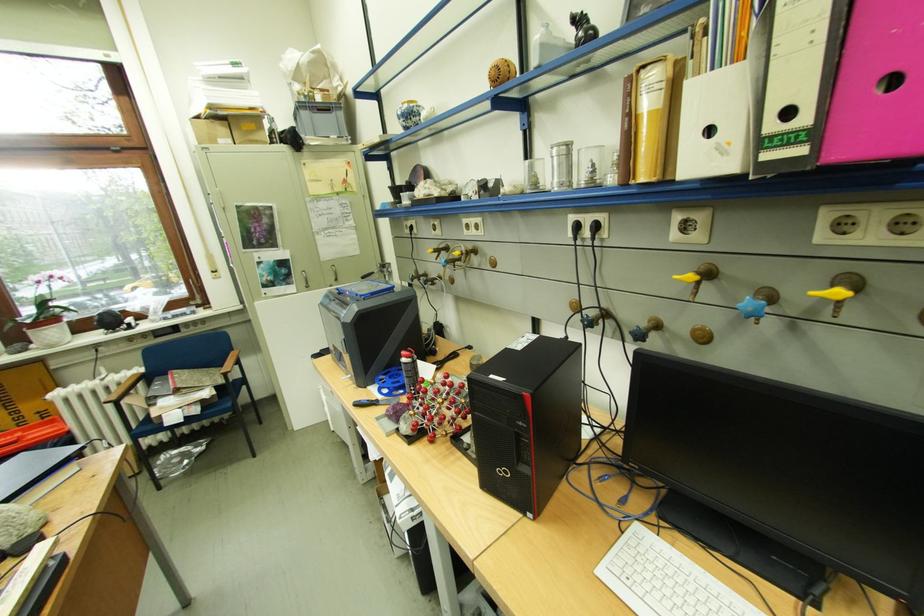
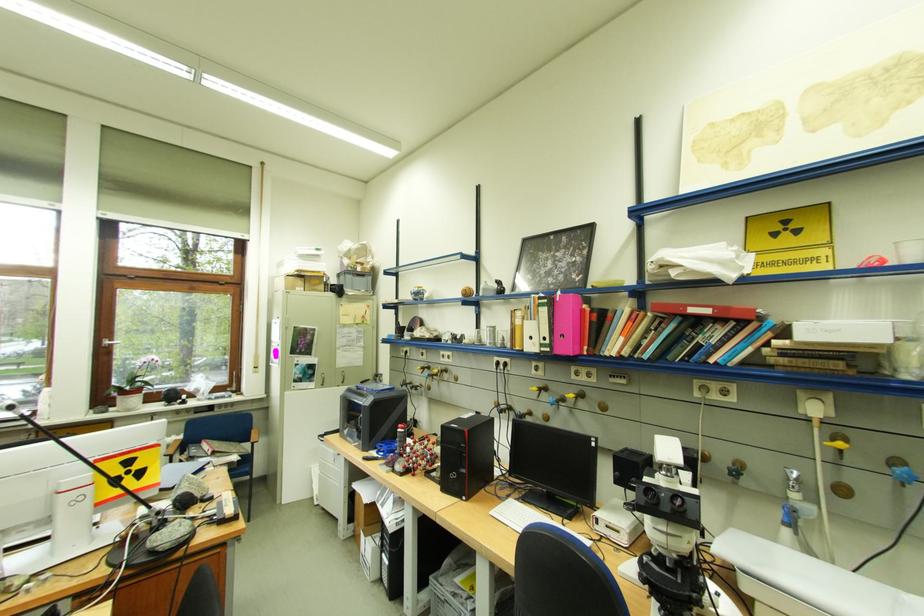
In the second image, find the point that corresponds to the point at 700,277 in the first image.

(544, 390)